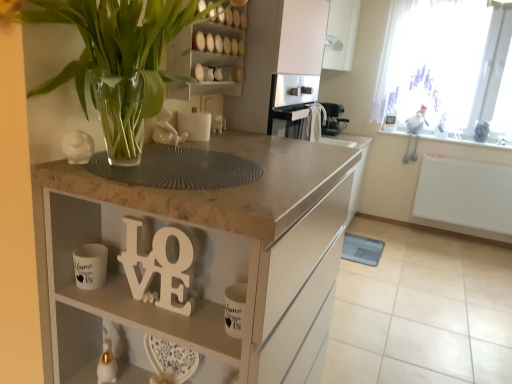
You are a GUI agent. You are given a task and a screenshot of the screen. Output one action in this format:
    pyautogui.click(x=<x>, y=<y>)
    Task: Click on the white glossy mug at lower left
    
    Given the screenshot: What is the action you would take?
    pyautogui.click(x=90, y=266)

The width and height of the screenshot is (512, 384). I want to click on white matte cabinet at upper center, so click(x=302, y=36).

Identify the location of matte stone countertop at center. (198, 262).

The image size is (512, 384). What do you see at coordinates (333, 119) in the screenshot?
I see `black plastic coffee machine at upper right` at bounding box center [333, 119].

The image size is (512, 384). I want to click on wooden shelves at upper center, so click(x=203, y=61).

Between white sheer curtain at upper right and wooden shelves at upper center, which one has smaller width?

wooden shelves at upper center.

Consider the image. Is white sheer curtain at upper right facing towards wooden shelves at upper center?

Yes, white sheer curtain at upper right is aimed at wooden shelves at upper center.

From a real-world perspective, which is physically above, white sheer curtain at upper right or wooden shelves at upper center?

white sheer curtain at upper right is physically above.

From the image's perspective, is wooden shelves at upper center located above or below white glossy mug at lower left?

wooden shelves at upper center is above white glossy mug at lower left.

Is wooden shelves at upper center placed right next to white glossy mug at lower left?

No.

Find the location of a particular element. The image size is (512, 384). cabinet that appears above the white glossy mug at lower left (from a real-world perspective) is located at coordinates (203, 61).

Is wooden shelves at upper center to the left or to the right of white glossy mug at lower left in the image?

wooden shelves at upper center is positioned on white glossy mug at lower left's right side.

From a real-world perspective, is black plastic coffee machine at upper right positioned over matte stone countertop at center based on gravity?

Yes.

In terms of size, does black plastic coffee machine at upper right appear bigger or smaller than matte stone countertop at center?

Considering their sizes, black plastic coffee machine at upper right takes up less space than matte stone countertop at center.

Which is less distant, (x=342, y=122) or (x=270, y=252)?

Point (x=342, y=122) appears to be farther away from the viewer than point (x=270, y=252).

Where is `coffee machine on the right of matte stone countertop at center`? The image size is (512, 384). coffee machine on the right of matte stone countertop at center is located at coordinates (333, 119).

Is clear glass vase at upper left located outside white sheer curtain at upper right?

Yes, clear glass vase at upper left is located beyond the bounds of white sheer curtain at upper right.

Locate an element on the screen. The image size is (512, 384). window above the clear glass vase at upper left (from the image's perspective) is located at coordinates (443, 63).

From the picture: From the image's perspective, between clear glass vase at upper left and white sheer curtain at upper right, which one is located above?

white sheer curtain at upper right appears higher in the image.

Which object is thinner, clear glass vase at upper left or white sheer curtain at upper right?

white sheer curtain at upper right is thinner.

From the picture: Between white sheer curtain at upper right and black plastic coffee machine at upper right, which one appears on the left side from the viewer's perspective?

black plastic coffee machine at upper right is more to the left.

Considering the sizes of objects white sheer curtain at upper right and black plastic coffee machine at upper right in the image provided, who is taller, white sheer curtain at upper right or black plastic coffee machine at upper right?

white sheer curtain at upper right is taller.

Looking at this image, is white sheer curtain at upper right behind black plastic coffee machine at upper right?

No, white sheer curtain at upper right is closer to the camera.

Is white sheer curtain at upper right far from black plastic coffee machine at upper right?

white sheer curtain at upper right is near black plastic coffee machine at upper right, not far away.

Considering the sizes of white matte cabinet at upper center and white matte wooden letters at center in the image, is white matte cabinet at upper center bigger or smaller than white matte wooden letters at center?

white matte cabinet at upper center is bigger than white matte wooden letters at center.

From the image's perspective, which one is positioned lower, white matte cabinet at upper center or white matte wooden letters at center?

From the image's view, white matte wooden letters at center is below.

In terms of height, does clear glass vase at upper left look taller or shorter compared to black plastic coffee machine at upper right?

clear glass vase at upper left is taller than black plastic coffee machine at upper right.

Is clear glass vase at upper left at the right side of black plastic coffee machine at upper right?

No.

Does clear glass vase at upper left have a larger size compared to black plastic coffee machine at upper right?

Yes.

From the image's perspective, is clear glass vase at upper left over black plastic coffee machine at upper right?

No, from the image's perspective, clear glass vase at upper left is not above black plastic coffee machine at upper right.

You are a GUI agent. You are given a task and a screenshot of the screen. Output one action in this format:
    pyautogui.click(x=<x>, y=<y>)
    Task: Click on the cabinet on the left of white sheer curtain at upper right
    
    Given the screenshot: What is the action you would take?
    pyautogui.click(x=203, y=61)

Where is `cabinet that appears behind the white glossy mug at lower left`? This screenshot has width=512, height=384. cabinet that appears behind the white glossy mug at lower left is located at coordinates (203, 61).

When comparing their distances from white glossy mug at lower left, does white matte wooden letters at center or clear glass vase at upper left seem further?

clear glass vase at upper left is positioned further to the anchor white glossy mug at lower left.

Based on their spatial positions, is clear glass vase at upper left or white matte wooden letters at center further from black plastic coffee machine at upper right?

white matte wooden letters at center is further to black plastic coffee machine at upper right.

Based on their spatial positions, is white sheer curtain at upper right or wooden shelves at upper center closer to clear glass vase at upper left?

Among the two, wooden shelves at upper center is located nearer to clear glass vase at upper left.

Estimate the real-world distances between objects in this image. Which object is closer to white sheer curtain at upper right, matte stone countertop at center or black plastic coffee machine at upper right?

Based on the image, black plastic coffee machine at upper right appears to be nearer to white sheer curtain at upper right.

Based on the photo, from the image, which object appears to be nearer to white matte wooden letters at center, black plastic coffee machine at upper right or white sheer curtain at upper right?

black plastic coffee machine at upper right lies closer to white matte wooden letters at center than the other object.

Which object lies further to the anchor point white matte wooden letters at center, clear glass vase at upper left or wooden shelves at upper center?

wooden shelves at upper center lies further to white matte wooden letters at center than the other object.

Considering their positions, is clear glass vase at upper left positioned closer to white matte wooden letters at center than white matte cabinet at upper center?

Based on the image, clear glass vase at upper left appears to be nearer to white matte wooden letters at center.

When comparing their distances from white matte cabinet at upper center, does wooden shelves at upper center or white sheer curtain at upper right seem closer?

Based on the image, wooden shelves at upper center appears to be nearer to white matte cabinet at upper center.

I want to click on cabinet positioned between white glossy mug at lower left and white matte cabinet at upper center from near to far, so click(x=203, y=61).

Locate an element on the screen. mug that lies between white matte wooden letters at center and matte stone countertop at center from top to bottom is located at coordinates (90, 266).

This screenshot has height=384, width=512. Find the location of `cabinetry positioned between white glossy mug at lower left and white sheer curtain at upper right from near to far`. cabinetry positioned between white glossy mug at lower left and white sheer curtain at upper right from near to far is located at coordinates (302, 36).

Find the location of `window positioned between white matte wooden letters at center and black plastic coffee machine at upper right from near to far`. window positioned between white matte wooden letters at center and black plastic coffee machine at upper right from near to far is located at coordinates (443, 63).